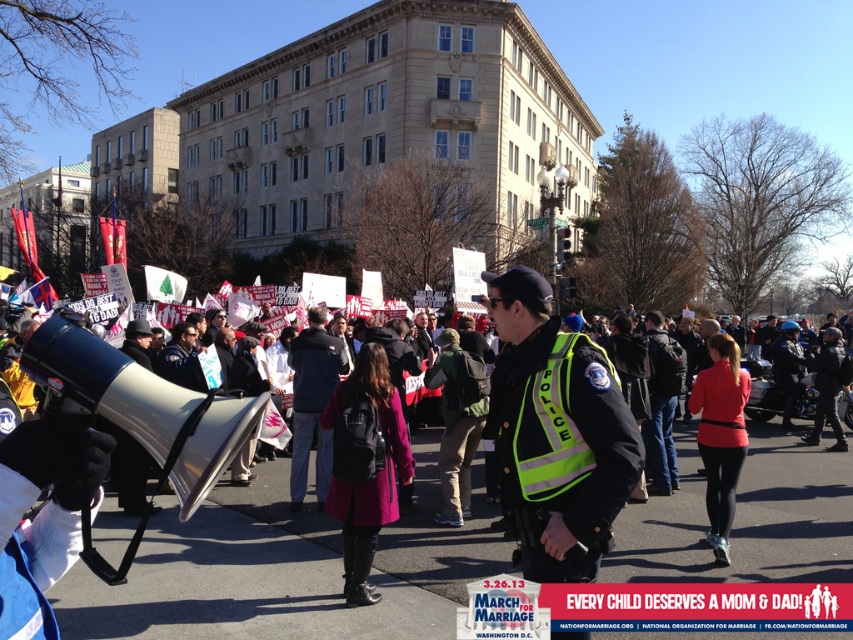
Who is more forward, [590,509] or [363,426]?

Point [590,509] is in front.

Is neon yellow reflective vest at center shorter than pink fabric coat at center?

Correct, neon yellow reflective vest at center is not as tall as pink fabric coat at center.

Where is `neon yellow reflective vest at center`? neon yellow reflective vest at center is located at coordinates (555, 435).

Is neon yellow reflective vest at center above red matte jacket at center?

Indeed, neon yellow reflective vest at center is positioned over red matte jacket at center.

Does neon yellow reflective vest at center have a greater width compared to red matte jacket at center?

Correct, the width of neon yellow reflective vest at center exceeds that of red matte jacket at center.

Is point (612, 486) positioned in front of point (733, 404)?

Yes.

This screenshot has width=853, height=640. I want to click on neon yellow reflective vest at center, so 555,435.

Between pink fabric coat at center and red matte jacket at center, which one is positioned lower?

pink fabric coat at center

Can you confirm if pink fabric coat at center is taller than red matte jacket at center?

Incorrect, pink fabric coat at center's height is not larger of red matte jacket at center's.

Based on the photo, measure the distance between pink fabric coat at center and camera.

The distance of pink fabric coat at center from camera is 5.66 meters.

Where is `pink fabric coat at center`? Image resolution: width=853 pixels, height=640 pixels. pink fabric coat at center is located at coordinates (360, 467).